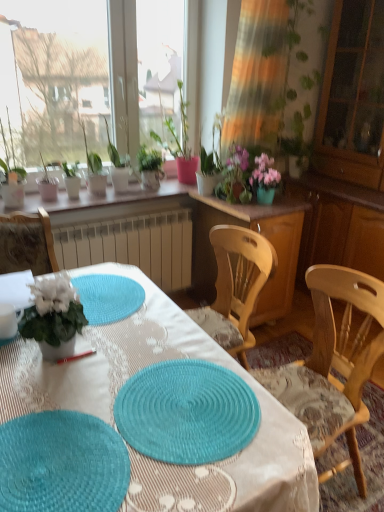
What are the coordinates of `free spot behind white matte plant at left, the 5th houseplant from the left` in the screenshot? It's located at (102, 313).